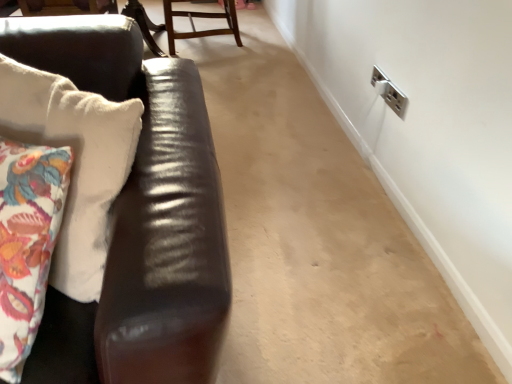
Question: Is shiny brown leather couch at left taller or shorter than wooden chair at upper center?

Choices:
 (A) short
 (B) tall

Answer: (B)

Question: Do you think shiny brown leather couch at left is within wooden chair at upper center, or outside of it?

Choices:
 (A) inside
 (B) outside

Answer: (B)

Question: From a real-world perspective, is shiny brown leather couch at left positioned above or below wooden chair at upper center?

Choices:
 (A) above
 (B) below

Answer: (A)

Question: From a real-world perspective, relative to shiny brown leather couch at left, is wooden chair at upper center vertically above or below?

Choices:
 (A) above
 (B) below

Answer: (B)

Question: In terms of height, does wooden chair at upper center look taller or shorter compared to shiny brown leather couch at left?

Choices:
 (A) short
 (B) tall

Answer: (A)

Question: In the image, is wooden chair at upper center positioned in front of or behind shiny brown leather couch at left?

Choices:
 (A) behind
 (B) front

Answer: (A)

Question: Considering the relative positions of wooden chair at upper center and shiny brown leather couch at left in the image provided, is wooden chair at upper center to the left or to the right of shiny brown leather couch at left?

Choices:
 (A) left
 (B) right

Answer: (B)